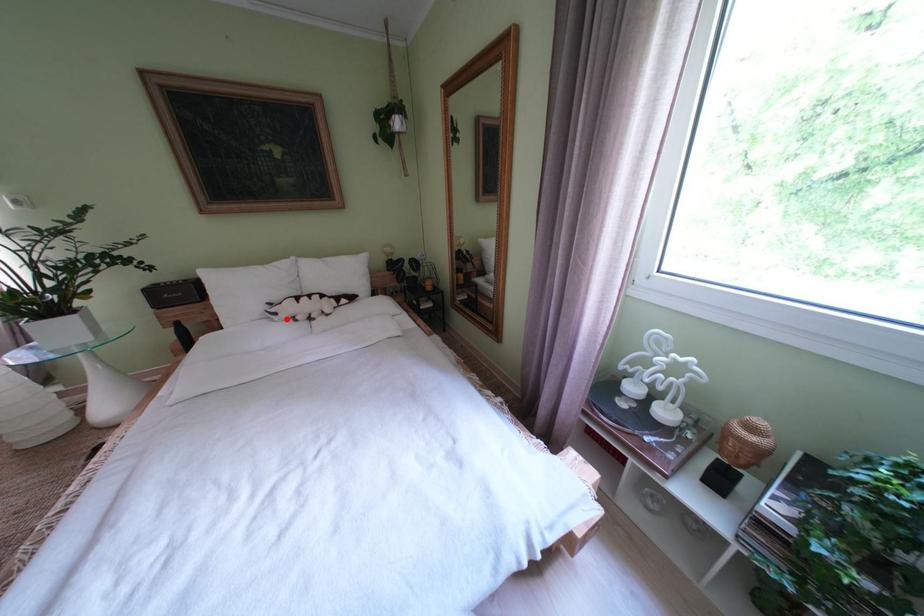
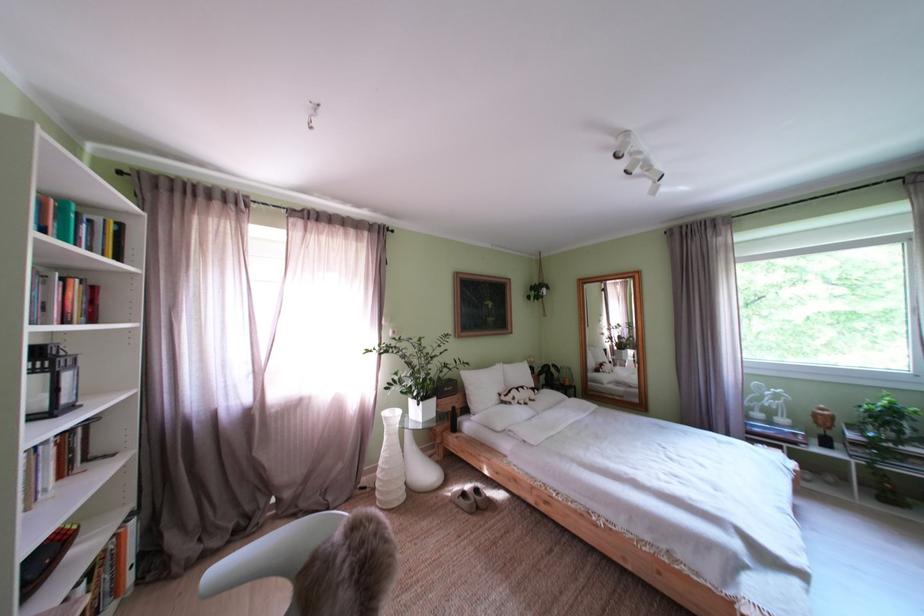
The point at the highlighted location is marked in the first image. Where is the corresponding point in the second image?

(525, 405)